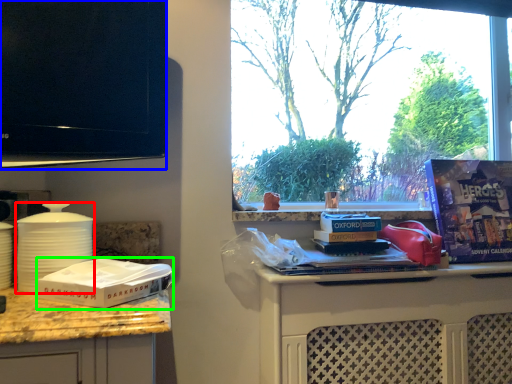
Question: Which object is positioned closest to kitchen appliance (highlighted by a red box)? Select from television (highlighted by a blue box) and box (highlighted by a green box).

Choices:
 (A) television
 (B) box

Answer: (B)